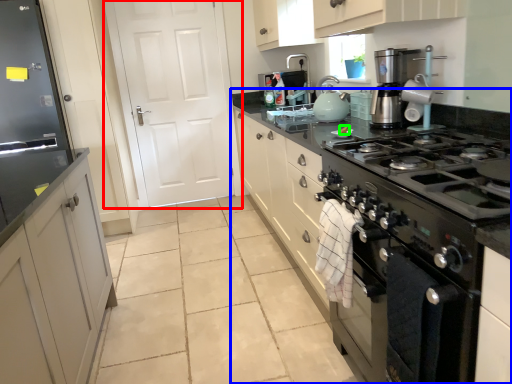
Question: Which object is positioned farthest from door (highlighted by a red box)? Select from countertop (highlighted by a blue box) and food (highlighted by a green box).

Choices:
 (A) countertop
 (B) food

Answer: (A)